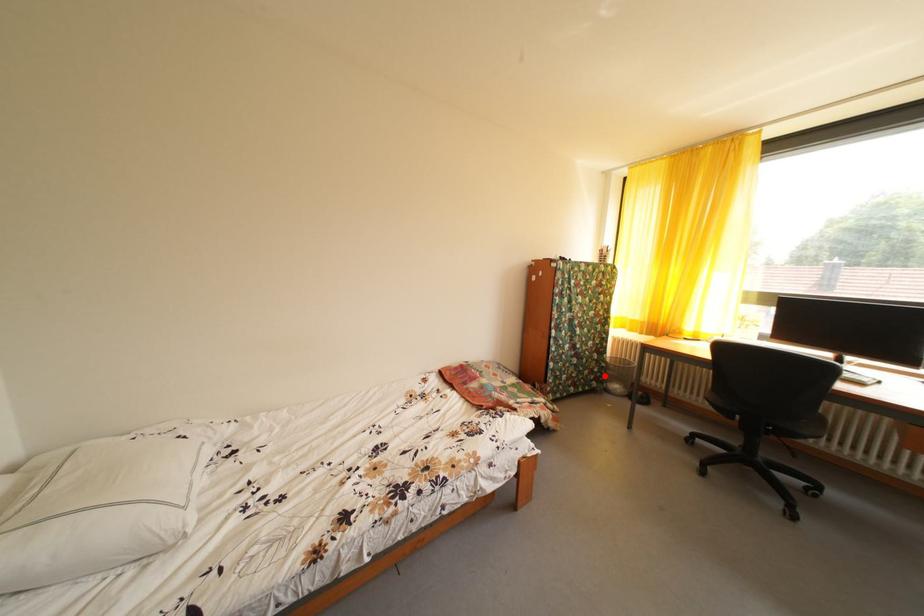
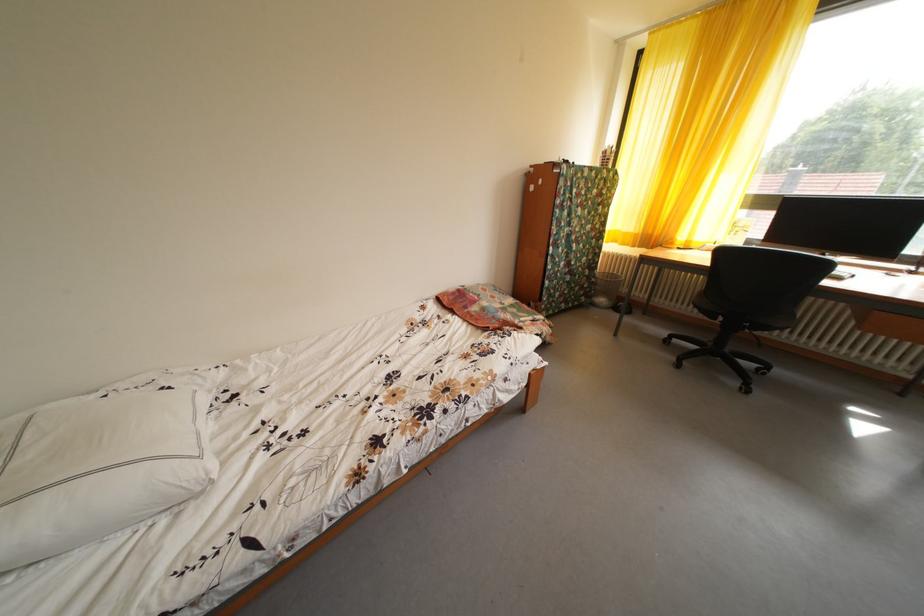
In the second image, find the point that corresponds to the highlighted location in the first image.

(594, 292)